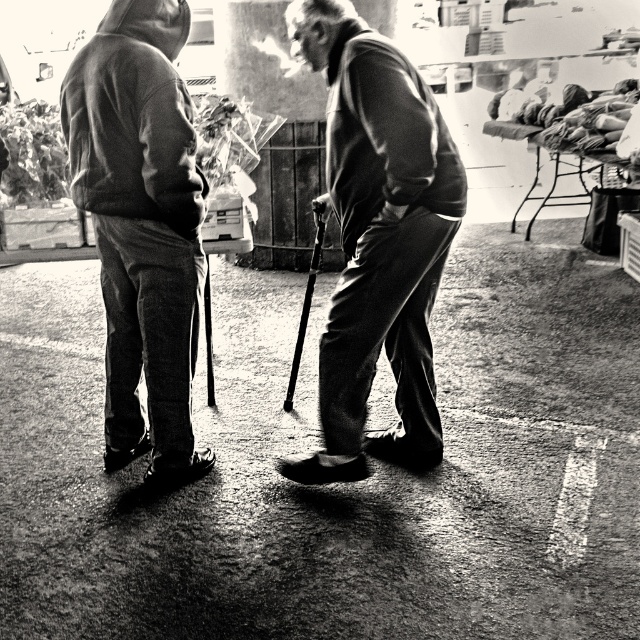
Does dark gray hoodie at left lie behind smooth metal cane at center?

No, it is not.

Can you confirm if dark gray hoodie at left is bigger than smooth metal cane at center?

Indeed, dark gray hoodie at left has a larger size compared to smooth metal cane at center.

Image resolution: width=640 pixels, height=640 pixels. In order to click on dark gray hoodie at left in this screenshot , I will do `click(141, 225)`.

Who is positioned more to the right, dark gray hoodie at left or metallic silver ski pole at center?

metallic silver ski pole at center is more to the right.

Is point (97, 220) positioned behind point (205, 292)?

No, it is in front of (205, 292).

Between point (115, 376) and point (205, 330), which one is positioned in front?

Point (115, 376) is in front.

At what (x,y) coordinates should I click in order to perform the action: click on dark gray hoodie at left. Please return your answer as a coordinate pair (x, y). Looking at the image, I should click on (141, 225).

Can you confirm if smooth fabric jacket at center is bigger than metallic silver ski pole at center?

Yes.

Who is taller, smooth fabric jacket at center or metallic silver ski pole at center?

With more height is smooth fabric jacket at center.

Does point (339, 403) come farther from viewer compared to point (208, 326)?

No, it is not.

The height and width of the screenshot is (640, 640). I want to click on smooth fabric jacket at center, so click(378, 240).